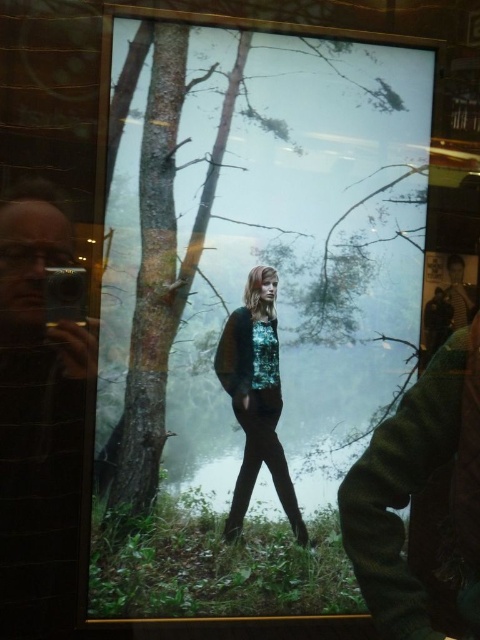
You are a photographer trying to set up equipment for a portrait session in the forest. You have a matte black camera at left and a shiny teal blouse at center. Which object should you adjust first if you want to ensure both items are visible in the frame without one blocking the other?

The matte black camera at left is larger than the shiny teal blouse at center, so you should adjust the position of the matte black camera at left first to prevent it from blocking the blouse.

Looking at this image, you are a photographer trying to capture the woman in the forest scene. You have a matte black camera at left and a shiny teal blouse at center. Which object is positioned higher in the frame?

The matte black camera at left is positioned higher than the shiny teal blouse at center in the frame.

You are a photographer trying to capture the scene through the reflective surface. You notice the matte black camera at left and the shiny teal blouse at center. Which object is positioned more to the left side of the reflective surface?

The matte black camera at left is positioned more to the left side of the reflective surface than the shiny teal blouse at center.